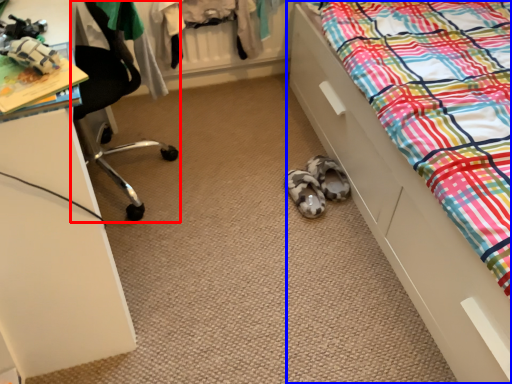
Question: Which of the following is the closest to the observer, chair (highlighted by a red box) or bed (highlighted by a blue box)?

Choices:
 (A) chair
 (B) bed

Answer: (B)